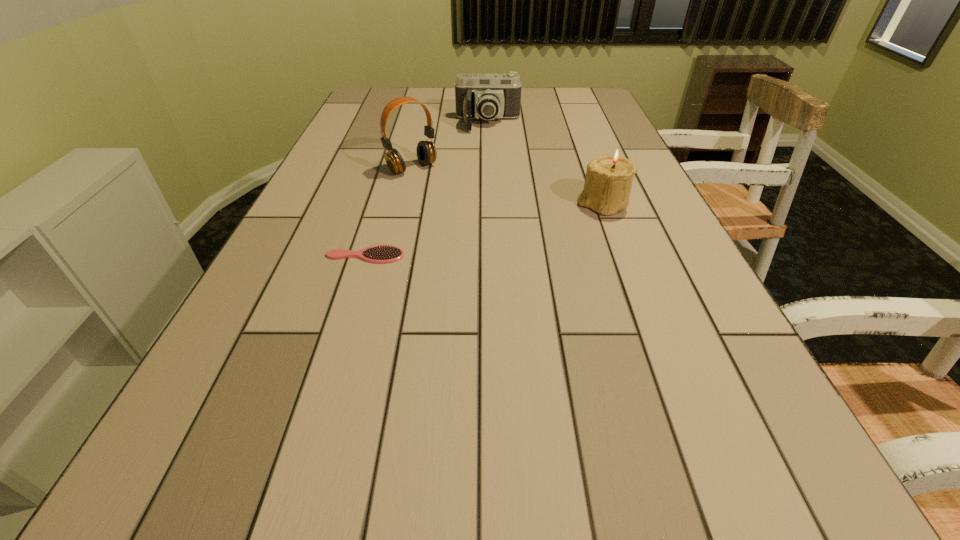
Where is `free space on the desktop that is between the nearest object and the rightmost object and is positioned on the ear cups of the tallest object`? The height and width of the screenshot is (540, 960). free space on the desktop that is between the nearest object and the rightmost object and is positioned on the ear cups of the tallest object is located at coordinates (483, 230).

The image size is (960, 540). What are the coordinates of `vacant space on the desktop that is between the shortest object and the candle_holder and is positioned at the front of the camera with an open lens cover` in the screenshot? It's located at pos(490,228).